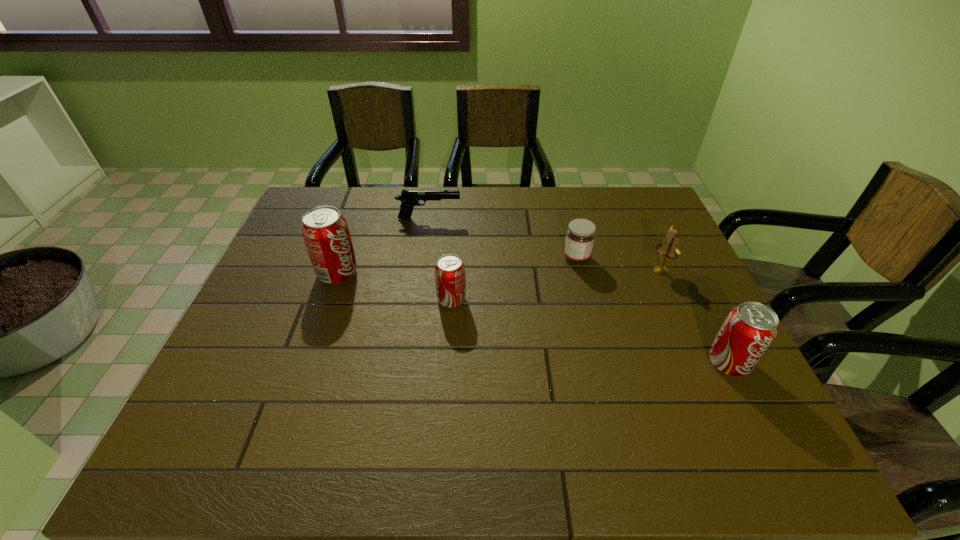
What are the coordinates of `the farthest soda` in the screenshot? It's located at (325, 231).

Locate an element on the screen. the tallest object is located at coordinates (325, 231).

Locate an element on the screen. the fifth farthest object is located at coordinates (450, 280).

This screenshot has height=540, width=960. In order to click on the shortest soda in this screenshot , I will do `click(450, 280)`.

Find the location of a particular element. Image resolution: width=960 pixels, height=540 pixels. the nearest object is located at coordinates (748, 331).

Locate an element on the screen. the rightmost soda is located at coordinates (748, 331).

At what (x,y) coordinates should I click in order to perform the action: click on candle holder. Please return your answer as a coordinate pair (x, y). Image resolution: width=960 pixels, height=540 pixels. Looking at the image, I should click on (668, 250).

Find the location of `gun`. gun is located at coordinates (409, 198).

Find the location of a particular element. Image resolution: width=960 pixels, height=540 pixels. the fourth object from left to right is located at coordinates (580, 235).

This screenshot has height=540, width=960. What are the coordinates of `vacant area located 0.060m on the back of the tallest soda` in the screenshot? It's located at (347, 247).